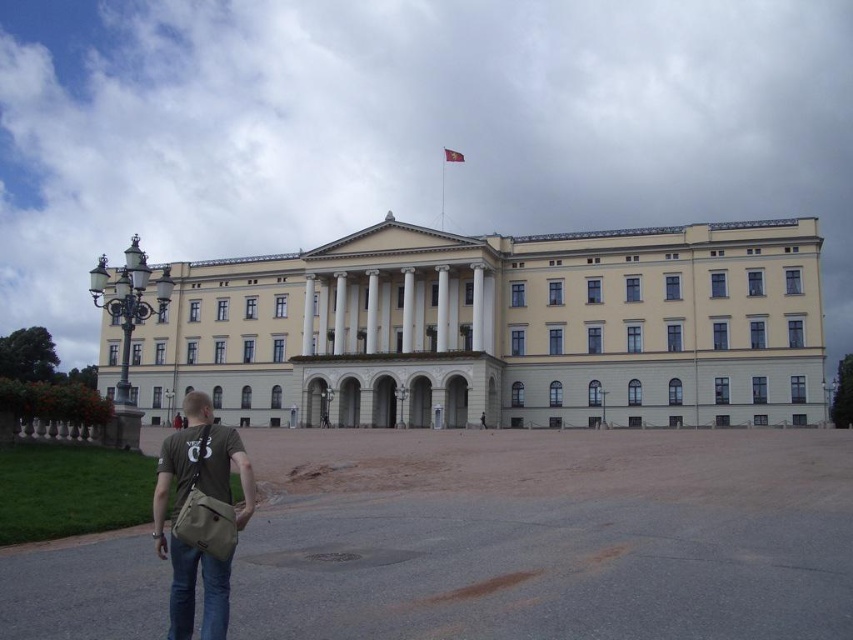
Question: Can you confirm if yellow stone building at center is positioned below white marble pillar at center?

Choices:
 (A) no
 (B) yes

Answer: (B)

Question: Which is nearer to the brown leather backpack at lower center?

Choices:
 (A) gold metallic flag at upper center
 (B) yellow stone building at center

Answer: (B)

Question: Which object appears closest to the camera in this image?

Choices:
 (A) khaki canvas bag at lower left
 (B) green fabric backpack at lower left

Answer: (A)

Question: Estimate the real-world distances between objects in this image. Which object is farther from the brown leather backpack at lower center?

Choices:
 (A) white marble pillar at center
 (B) green fabric backpack at lower left

Answer: (B)

Question: Can you confirm if yellow stone building at center is smaller than gold metallic flag at upper center?

Choices:
 (A) no
 (B) yes

Answer: (A)

Question: Can you confirm if yellow stone building at center is wider than brown leather backpack at lower center?

Choices:
 (A) no
 (B) yes

Answer: (B)